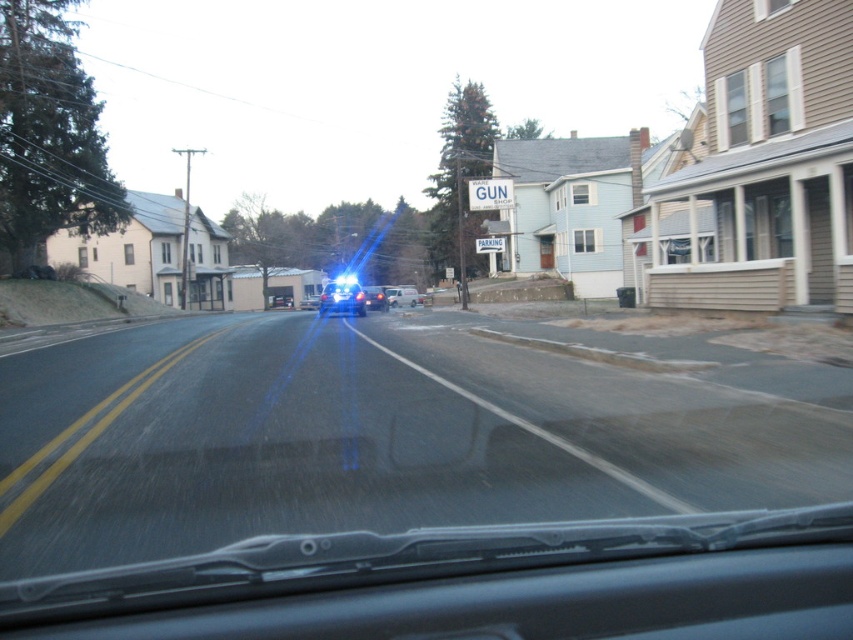
Question: Considering the real-world distances, which object is closest to the transparent glass windshield at center?

Choices:
 (A) silver metallic sedan at center
 (B) glossy blue car at center

Answer: (B)

Question: Estimate the real-world distances between objects in this image. Which object is farther from the glossy plastic car at center?

Choices:
 (A) transparent glass windshield at center
 (B) glossy blue car at center
 (C) silver metallic sedan at center

Answer: (A)

Question: Does glossy plastic car at center come in front of glossy blue car at center?

Choices:
 (A) no
 (B) yes

Answer: (B)

Question: Which point is closer to the camera?

Choices:
 (A) glossy blue car at center
 (B) silver metallic sedan at center

Answer: (A)

Question: From the image, what is the correct spatial relationship of silver metallic sedan at center in relation to glossy blue car at center?

Choices:
 (A) right
 (B) left

Answer: (A)

Question: Is transparent glass windshield at center wider than glossy blue car at center?

Choices:
 (A) no
 (B) yes

Answer: (B)